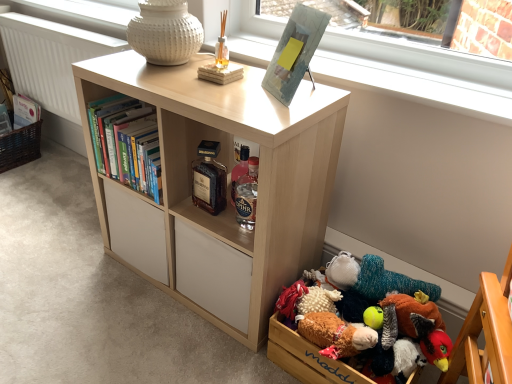
Identify the location of free spot above light wood bookcase at center (from a real-world perspective). (219, 84).